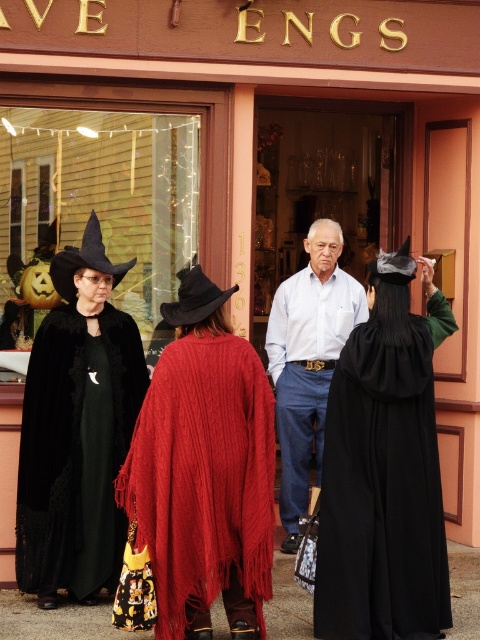
You are a costume designer observing the scene outside VE ENG S. You need to determine which costume item takes up more horizontal space. Which item has a greater width between the black velvet cape at center and the light blue shirt at center?

The black velvet cape at center has a greater width than the light blue shirt at center.

You are standing in front of the store and want to find the black velvet cape at center. According to the coordinates given, where should you look relative to the entrance?

The black velvet cape at center is located at coordinates point [384,470], which is to the right and slightly below the entrance of the store.